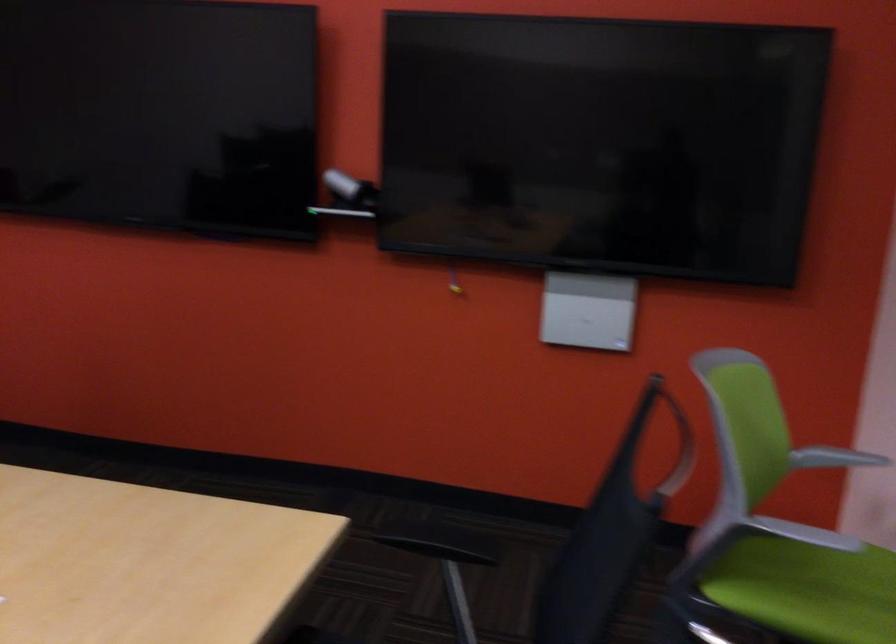
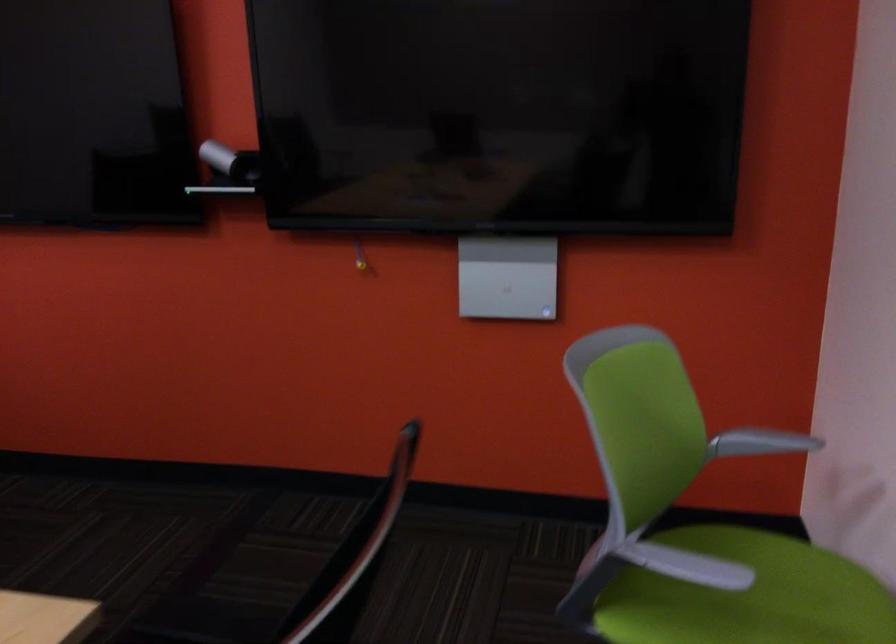
In a continuous first-person perspective shot, in which direction is the camera moving?

The cameraman moved toward right, forward.